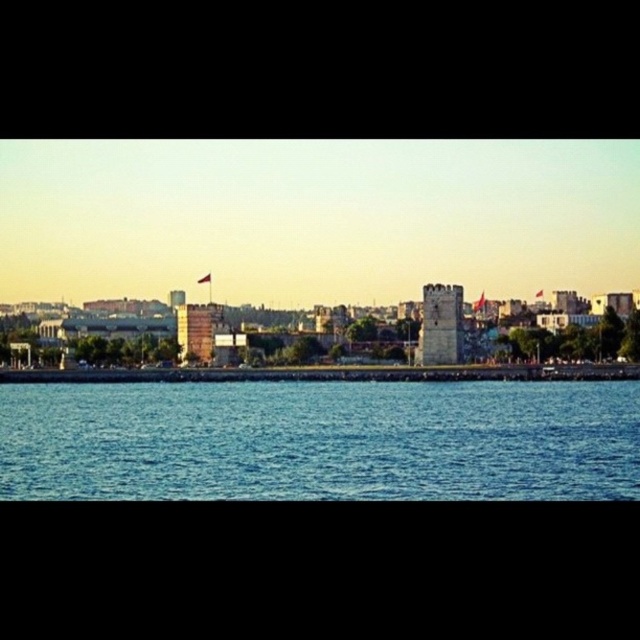
From the picture: Is blue liquid water at lower center to the right of stone tower at center from the viewer's perspective?

In fact, blue liquid water at lower center is to the left of stone tower at center.

Find the location of a particular element. This screenshot has width=640, height=640. blue liquid water at lower center is located at coordinates (321, 440).

Looking at this image, does blue liquid water at lower center have a greater height compared to brick tower at center?

Correct, blue liquid water at lower center is much taller as brick tower at center.

What do you see at coordinates (321, 440) in the screenshot? The image size is (640, 640). I see `blue liquid water at lower center` at bounding box center [321, 440].

Locate an element on the screen. blue liquid water at lower center is located at coordinates (321, 440).

Locate an element on the screen. The width and height of the screenshot is (640, 640). blue liquid water at lower center is located at coordinates (321, 440).

Is stone tower at center thinner than brick tower at center?

Indeed, stone tower at center has a lesser width compared to brick tower at center.

Does stone tower at center have a greater height compared to brick tower at center?

Correct, stone tower at center is much taller as brick tower at center.

Describe the element at coordinates (440, 324) in the screenshot. I see `stone tower at center` at that location.

You are a GUI agent. You are given a task and a screenshot of the screen. Output one action in this format:
    pyautogui.click(x=<x>, y=<y>)
    Task: Click on the stone tower at center
    The width and height of the screenshot is (640, 640).
    Given the screenshot: What is the action you would take?
    pyautogui.click(x=440, y=324)